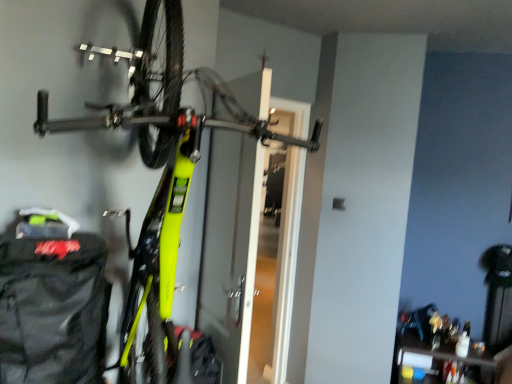
This screenshot has width=512, height=384. What do you see at coordinates (52, 302) in the screenshot?
I see `black fabric backpack at lower left` at bounding box center [52, 302].

What is the approximate width of black fabric backpack at lower left?

black fabric backpack at lower left is 13.82 inches in width.

In order to click on black fabric backpack at lower left in this screenshot , I will do click(x=52, y=302).

Describe the element at coordinates (164, 170) in the screenshot. I see `neon yellow matte bicycle at center` at that location.

What is the approximate width of neon yellow matte bicycle at center?

neon yellow matte bicycle at center is 3.53 feet in width.

Where is `neon yellow matte bicycle at center`? This screenshot has width=512, height=384. neon yellow matte bicycle at center is located at coordinates (164, 170).

Identify the location of black fabric backpack at lower left. This screenshot has height=384, width=512. (52, 302).

In the scene shown: Which is more to the right, black fabric backpack at lower left or neon yellow matte bicycle at center?

neon yellow matte bicycle at center.

Is black fabric backpack at lower left closer to camera compared to neon yellow matte bicycle at center?

No, black fabric backpack at lower left is further to the viewer.

Is point (74, 256) positioned in front of point (140, 283)?

No, it is not.

From the picture: From the image's perspective, between black fabric backpack at lower left and neon yellow matte bicycle at center, who is located below?

black fabric backpack at lower left, from the image's perspective.

From a real-world perspective, who is located lower, black fabric backpack at lower left or neon yellow matte bicycle at center?

black fabric backpack at lower left is physically lower.

Considering the sizes of black fabric backpack at lower left and neon yellow matte bicycle at center in the image, is black fabric backpack at lower left wider or thinner than neon yellow matte bicycle at center?

black fabric backpack at lower left is thinner than neon yellow matte bicycle at center.

Considering the sizes of black fabric backpack at lower left and neon yellow matte bicycle at center in the image, is black fabric backpack at lower left taller or shorter than neon yellow matte bicycle at center?

In the image, black fabric backpack at lower left appears to be shorter than neon yellow matte bicycle at center.

Looking at the image, does black fabric backpack at lower left seem bigger or smaller compared to neon yellow matte bicycle at center?

Considering their sizes, black fabric backpack at lower left takes up less space than neon yellow matte bicycle at center.

Is black fabric backpack at lower left completely or partially outside of neon yellow matte bicycle at center?

Actually, black fabric backpack at lower left is within neon yellow matte bicycle at center.

Can you see black fabric backpack at lower left touching neon yellow matte bicycle at center?

No, black fabric backpack at lower left is not making contact with neon yellow matte bicycle at center.

Could you tell me if black fabric backpack at lower left is facing neon yellow matte bicycle at center?

Yes, black fabric backpack at lower left is oriented towards neon yellow matte bicycle at center.

Image resolution: width=512 pixels, height=384 pixels. I want to click on bicycle above the black fabric backpack at lower left (from the image's perspective), so click(164, 170).

Considering the positions of objects neon yellow matte bicycle at center and black fabric backpack at lower left in the image provided, who is more to the left, neon yellow matte bicycle at center or black fabric backpack at lower left?

black fabric backpack at lower left.

Which is behind, neon yellow matte bicycle at center or black fabric backpack at lower left?

black fabric backpack at lower left is further from the camera.

Does point (123, 356) come farther from viewer compared to point (19, 229)?

Yes, point (123, 356) is behind point (19, 229).

From the image's perspective, is neon yellow matte bicycle at center over black fabric backpack at lower left?

Yes, from the image's perspective, neon yellow matte bicycle at center is above black fabric backpack at lower left.

From a real-world perspective, does neon yellow matte bicycle at center sit lower than black fabric backpack at lower left?

No, from a real-world perspective, neon yellow matte bicycle at center is not below black fabric backpack at lower left.

Which object is thinner, neon yellow matte bicycle at center or black fabric backpack at lower left?

black fabric backpack at lower left.

Considering the relative sizes of neon yellow matte bicycle at center and black fabric backpack at lower left in the image provided, is neon yellow matte bicycle at center shorter than black fabric backpack at lower left?

Incorrect, the height of neon yellow matte bicycle at center does not fall short of that of black fabric backpack at lower left.

Who is smaller, neon yellow matte bicycle at center or black fabric backpack at lower left?

black fabric backpack at lower left.

Do you think neon yellow matte bicycle at center is within black fabric backpack at lower left, or outside of it?

neon yellow matte bicycle at center cannot be found inside black fabric backpack at lower left.

Is neon yellow matte bicycle at center far from black fabric backpack at lower left?

No, neon yellow matte bicycle at center is not far from black fabric backpack at lower left.

Is neon yellow matte bicycle at center oriented away from black fabric backpack at lower left?

Yes, neon yellow matte bicycle at center is positioned with its back facing black fabric backpack at lower left.

How different are the orientations of neon yellow matte bicycle at center and black fabric backpack at lower left in degrees?

The angle between the facing direction of neon yellow matte bicycle at center and the facing direction of black fabric backpack at lower left is 3.62 degrees.

Where is `backpack on the left of neon yellow matte bicycle at center`? This screenshot has height=384, width=512. backpack on the left of neon yellow matte bicycle at center is located at coordinates (52, 302).

This screenshot has height=384, width=512. In the image, there is a neon yellow matte bicycle at center. In order to click on backpack below it (from a real-world perspective) in this screenshot , I will do `click(52, 302)`.

Where is `bicycle above the black fabric backpack at lower left (from a real-world perspective)`? The height and width of the screenshot is (384, 512). bicycle above the black fabric backpack at lower left (from a real-world perspective) is located at coordinates (164, 170).